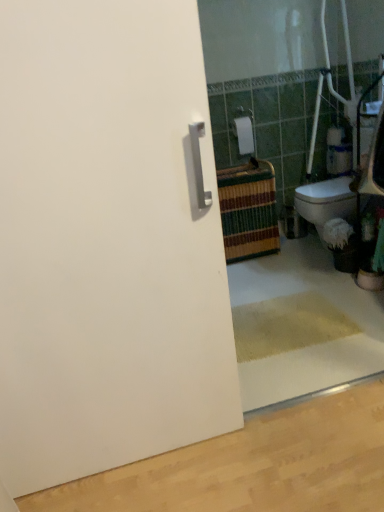
Question: Considering the positions of white matte toilet paper at upper center and white matte door at left in the image, is white matte toilet paper at upper center taller or shorter than white matte door at left?

Choices:
 (A) short
 (B) tall

Answer: (A)

Question: Choose the correct answer: Is white matte toilet paper at upper center inside white matte door at left or outside it?

Choices:
 (A) outside
 (B) inside

Answer: (A)

Question: Considering the positions of white matte toilet paper at upper center and white matte door at left in the image, is white matte toilet paper at upper center bigger or smaller than white matte door at left?

Choices:
 (A) big
 (B) small

Answer: (B)

Question: From the image's perspective, is white matte door at left above or below white matte toilet paper at upper center?

Choices:
 (A) above
 (B) below

Answer: (B)

Question: Is white matte door at left taller or shorter than white matte toilet paper at upper center?

Choices:
 (A) short
 (B) tall

Answer: (B)

Question: Looking at their shapes, would you say white matte door at left is wider or thinner than white matte toilet paper at upper center?

Choices:
 (A) wide
 (B) thin

Answer: (B)

Question: In the image, is white matte door at left on the left side or the right side of white matte toilet paper at upper center?

Choices:
 (A) left
 (B) right

Answer: (A)